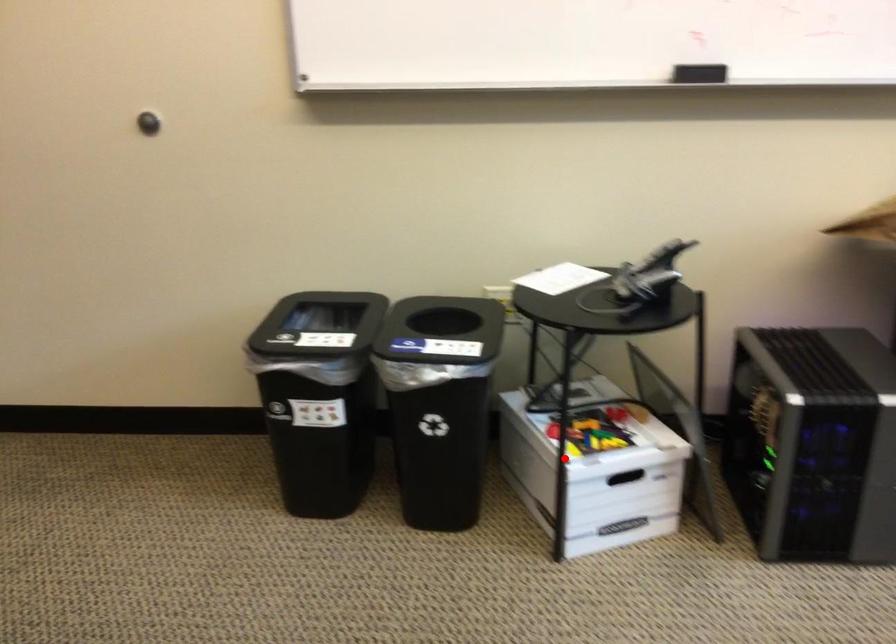
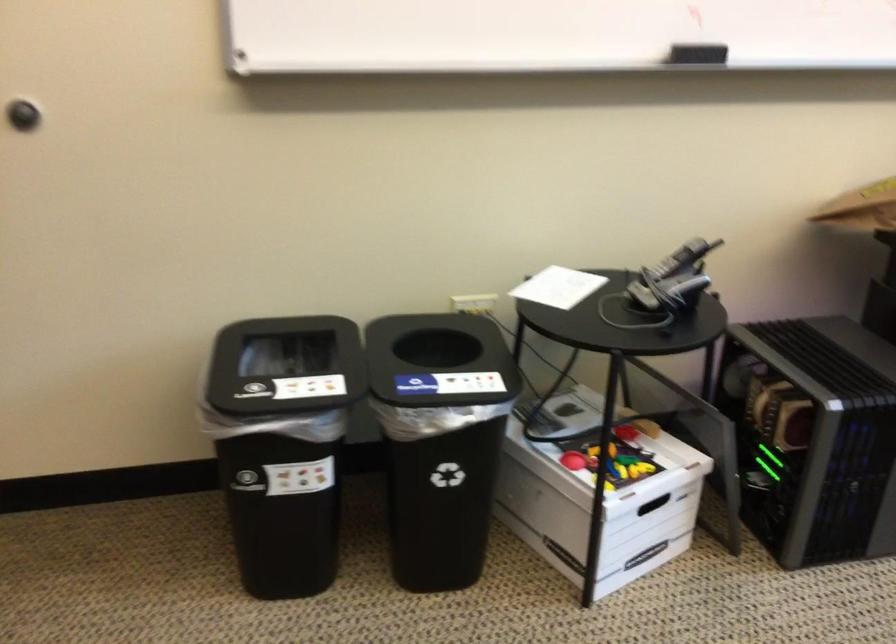
Question: I am providing you with two images of the same scene from different viewpoints. A red point is shown in image1. For the corresponding object point in image2, is it positioned nearer or farther from the camera?

Choices:
 (A) Nearer
 (B) Farther

Answer: (A)